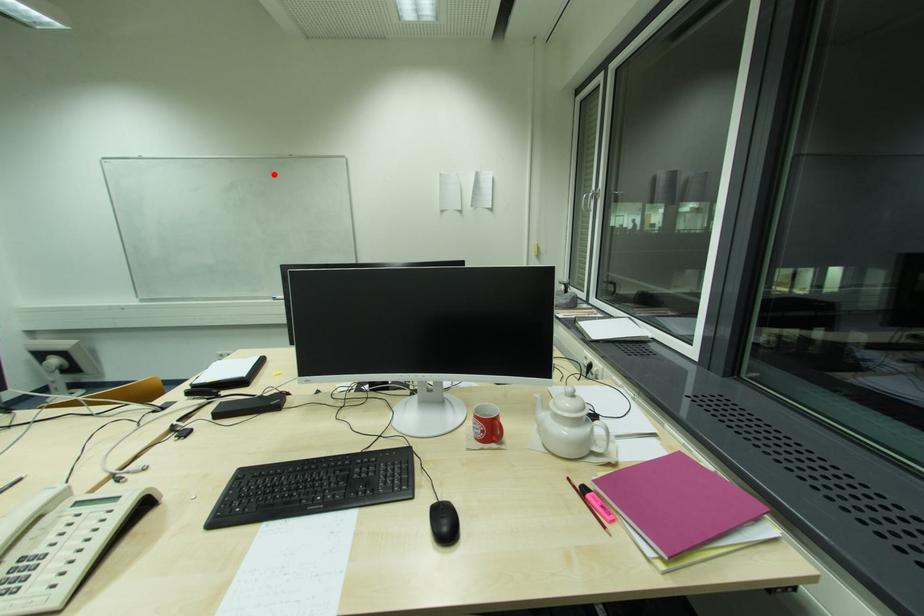
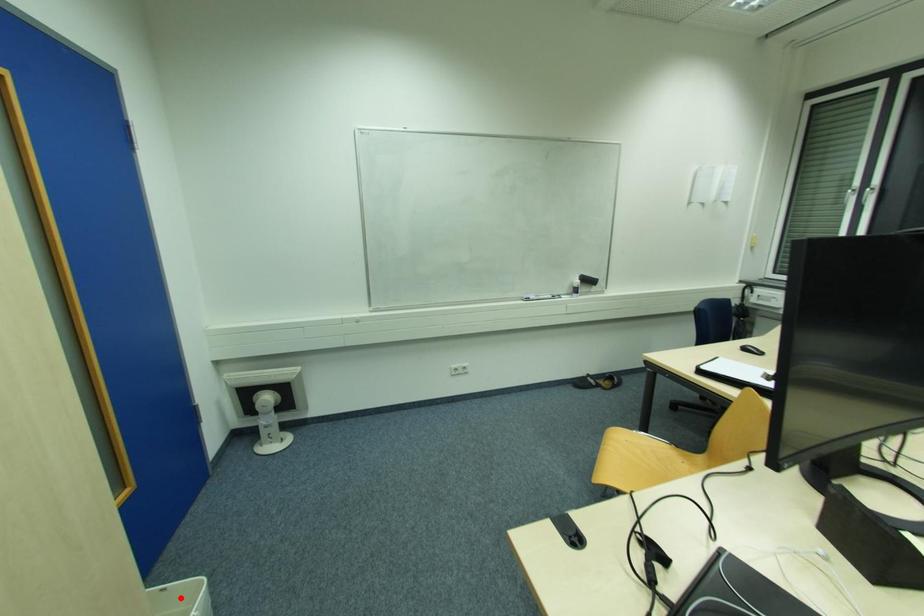
I am providing you with two images of the same scene from different viewpoints. A red point is marked on the first image and another point is marked on the second image. Does the point marked in image1 correspond to the same location as the one in image2?

No